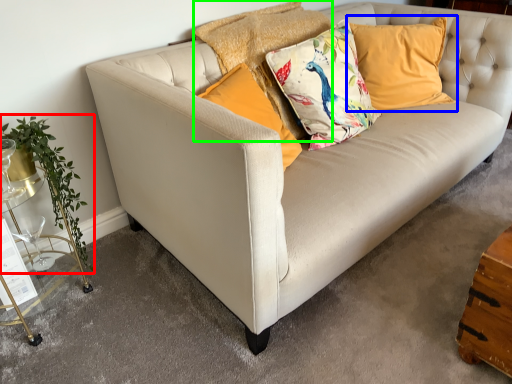
Question: Which is nearer to the plant (highlighted by a red box)? pillow (highlighted by a blue box) or pillow (highlighted by a green box).

Choices:
 (A) pillow
 (B) pillow

Answer: (B)